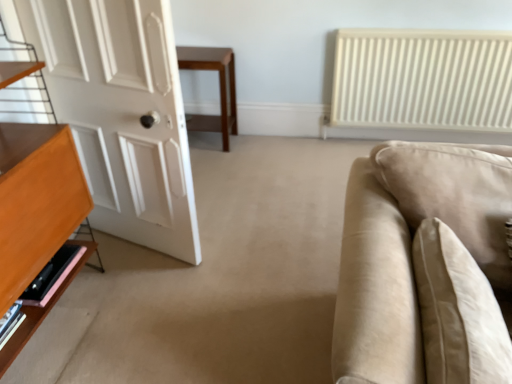
This screenshot has width=512, height=384. What do you see at coordinates (122, 113) in the screenshot?
I see `white matte door at left` at bounding box center [122, 113].

The height and width of the screenshot is (384, 512). What do you see at coordinates (425, 266) in the screenshot?
I see `beige fabric couch at right` at bounding box center [425, 266].

This screenshot has width=512, height=384. Describe the element at coordinates (458, 311) in the screenshot. I see `beige fabric pillow at right` at that location.

The image size is (512, 384). Find the location of `wooden table at center`. wooden table at center is located at coordinates (220, 89).

The image size is (512, 384). Identify the location of white matte door at left. (122, 113).

Can you tell me how much beige fabric pillow at right and pink wood shelf at lower left differ in facing direction?

beige fabric pillow at right and pink wood shelf at lower left are facing 91.9 degrees away from each other.

Who is taller, beige fabric pillow at right or pink wood shelf at lower left?

beige fabric pillow at right.

From the picture: Is pink wood shelf at lower left at the back of beige fabric pillow at right?

No.

Which object is positioned more to the left, beige fabric pillow at right or pink wood shelf at lower left?

From the viewer's perspective, pink wood shelf at lower left appears more on the left side.

Is beige fabric couch at right not inside beige fabric pillow at right?

Yes, beige fabric couch at right is outside of beige fabric pillow at right.

Are beige fabric couch at right and beige fabric pillow at right located far from each other?

That's not correct — beige fabric couch at right is a little close to beige fabric pillow at right.

Consider the image. How many degrees apart are the facing directions of beige fabric couch at right and beige fabric pillow at right?

They differ by 2.81 degrees in their facing directions.

Could you tell me if beige fabric couch at right is turned towards beige fabric pillow at right?

Yes.

Considering the positions of objects white matte door at left and pink wood shelf at lower left in the image provided, who is more to the right, white matte door at left or pink wood shelf at lower left?

white matte door at left is more to the right.

From the image's perspective, does white matte door at left appear higher than pink wood shelf at lower left?

Correct, white matte door at left appears higher than pink wood shelf at lower left in the image.

Is white matte door at left directly adjacent to pink wood shelf at lower left?

No, white matte door at left is not next to pink wood shelf at lower left.

Considering the positions of points (49, 35) and (20, 298), is point (49, 35) closer to camera compared to point (20, 298)?

No, (49, 35) is behind (20, 298).

Does wooden table at center contain beige fabric couch at right?

No, beige fabric couch at right is not a part of wooden table at center.

From the image's perspective, who appears lower, wooden table at center or beige fabric couch at right?

beige fabric couch at right.

Which of these two, wooden table at center or beige fabric couch at right, is bigger?

beige fabric couch at right is bigger.

This screenshot has height=384, width=512. Find the location of `table above the beige fabric couch at right (from the image's perspective)`. table above the beige fabric couch at right (from the image's perspective) is located at coordinates (220, 89).

Who is bigger, wooden table at center or pink wood shelf at lower left?

wooden table at center.

Is wooden table at center outside of pink wood shelf at lower left?

Yes, wooden table at center is located beyond the bounds of pink wood shelf at lower left.

Is wooden table at center next to pink wood shelf at lower left and touching it?

No, wooden table at center is not making contact with pink wood shelf at lower left.

Considering the relative sizes of wooden table at center and pink wood shelf at lower left in the image provided, is wooden table at center wider than pink wood shelf at lower left?

Yes, wooden table at center is wider than pink wood shelf at lower left.

Which object is thinner, beige fabric couch at right or white matte door at left?

white matte door at left.

Do you think beige fabric couch at right is within white matte door at left, or outside of it?

beige fabric couch at right exists outside the volume of white matte door at left.

Would you say beige fabric couch at right is to the left or to the right of white matte door at left in the picture?

beige fabric couch at right is to the right of white matte door at left.

Does beige fabric couch at right turn towards wooden table at center?

No, beige fabric couch at right is not oriented towards wooden table at center.

Would you say beige fabric couch at right is a long distance from wooden table at center?

Yes, beige fabric couch at right is far from wooden table at center.

Is beige fabric couch at right further to camera compared to wooden table at center?

That is False.

How different are the orientations of beige fabric couch at right and wooden table at center in degrees?

The angular difference between beige fabric couch at right and wooden table at center is 1.09 degrees.

The height and width of the screenshot is (384, 512). I want to click on shelf behind the beige fabric pillow at right, so click(x=52, y=276).

I want to click on studio couch in front of the beige fabric pillow at right, so click(x=425, y=266).

Looking at the image, which one is located further to beige fabric pillow at right, beige fabric couch at right or white matte door at left?

white matte door at left.

Based on the photo, looking at the image, which one is located further to beige fabric pillow at right, pink wood shelf at lower left or wooden table at center?

wooden table at center is further to beige fabric pillow at right.

Considering their positions, is white matte door at left positioned further to beige fabric pillow at right than beige fabric couch at right?

white matte door at left is further to beige fabric pillow at right.

Looking at the image, which one is located further to white matte door at left, beige fabric couch at right or wooden table at center?

wooden table at center is positioned further to the anchor white matte door at left.

Based on their spatial positions, is pink wood shelf at lower left or white matte door at left further from beige fabric pillow at right?

Among the two, pink wood shelf at lower left is located further to beige fabric pillow at right.

Considering their positions, is wooden table at center positioned further to pink wood shelf at lower left than white matte door at left?

wooden table at center is positioned further to the anchor pink wood shelf at lower left.

From the image, which object appears to be farther from pink wood shelf at lower left, beige fabric pillow at right or beige fabric couch at right?

beige fabric pillow at right lies further to pink wood shelf at lower left than the other object.

Considering their positions, is wooden table at center positioned closer to beige fabric pillow at right than beige fabric couch at right?

Among the two, beige fabric couch at right is located nearer to beige fabric pillow at right.

The width and height of the screenshot is (512, 384). Find the location of `door located between pink wood shelf at lower left and beige fabric couch at right in the left-right direction`. door located between pink wood shelf at lower left and beige fabric couch at right in the left-right direction is located at coordinates (122, 113).

You are a GUI agent. You are given a task and a screenshot of the screen. Output one action in this format:
    pyautogui.click(x=<x>, y=<y>)
    Task: Click on the pillow situated between pink wood shelf at lower left and beige fabric couch at right from left to right
    
    Given the screenshot: What is the action you would take?
    pyautogui.click(x=458, y=311)

Identify the location of shelf positioned between beige fabric pillow at right and wooden table at center from near to far. The image size is (512, 384). (52, 276).

Identify the location of door between pink wood shelf at lower left and beige fabric pillow at right from left to right. (122, 113).